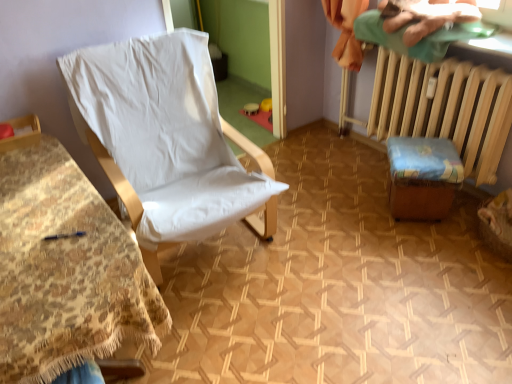
Image resolution: width=512 pixels, height=384 pixels. I want to click on vacant space in front of wooden stool at lower right, marked as the first furniture in a right-to-left arrangement, so click(x=426, y=248).